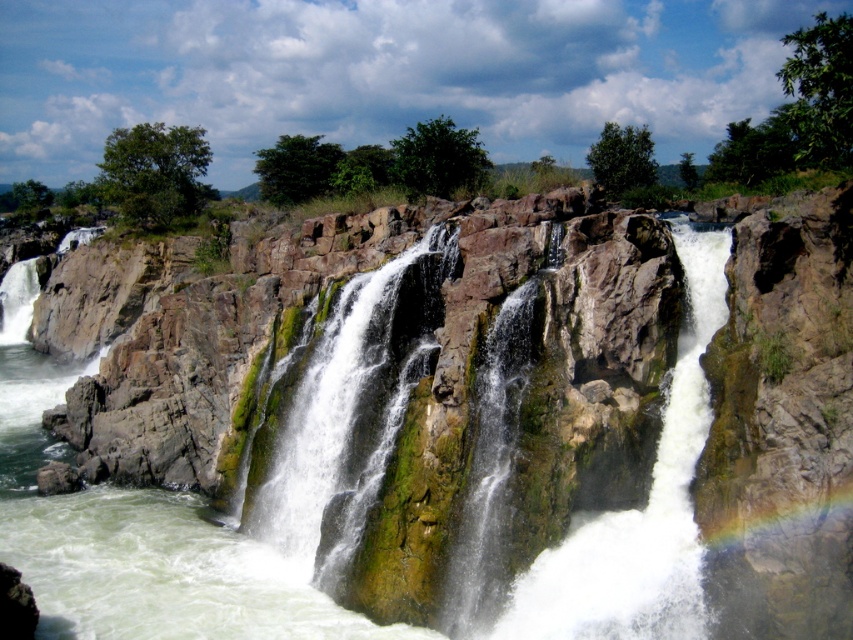
You are a hiker who wants to cross the waterfall area. You see the brown rough rock at center and the green mossy rock at center. Which rock is wider and can provide a safer stepping stone?

The brown rough rock at center is wider than the green mossy rock at center, so it can provide a safer stepping stone.

You are a photographer standing at the edge of the waterfall. You want to capture a clear shot of the brown rough rock at center. Considering your camera can focus on objects up to 25 meters away, will you be able to take a clear photo of the rock?

The brown rough rock at center is 24.42 meters away from the camera. Since your camera can focus up to 25 meters, you can take a clear photo of the rock as it is within the focus range.